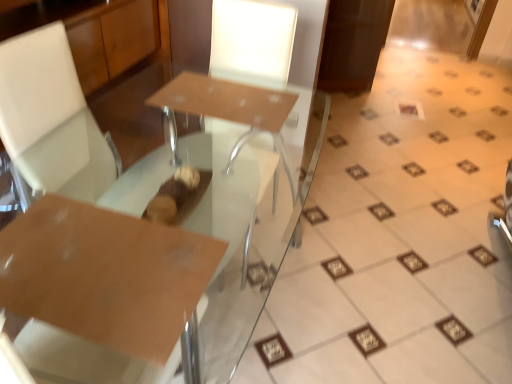
Question: Is glossy brown table at center positioned in front of white glossy frame at upper right?

Choices:
 (A) no
 (B) yes

Answer: (B)

Question: Considering the relative sizes of glossy brown table at center and white glossy frame at upper right in the image provided, is glossy brown table at center wider than white glossy frame at upper right?

Choices:
 (A) yes
 (B) no

Answer: (A)

Question: Is glossy brown table at center far from white glossy frame at upper right?

Choices:
 (A) yes
 (B) no

Answer: (A)

Question: Would you say glossy brown table at center contains white glossy frame at upper right?

Choices:
 (A) no
 (B) yes

Answer: (A)

Question: Does glossy brown table at center have a lesser height compared to white glossy frame at upper right?

Choices:
 (A) yes
 (B) no

Answer: (B)

Question: Can you confirm if glossy brown table at center is positioned to the right of white glossy frame at upper right?

Choices:
 (A) no
 (B) yes

Answer: (A)

Question: Is matte brown table at center not near white glossy frame at upper right?

Choices:
 (A) yes
 (B) no

Answer: (A)

Question: Can white glossy frame at upper right be found inside matte brown table at center?

Choices:
 (A) no
 (B) yes

Answer: (A)

Question: Is matte brown table at center positioned before white glossy frame at upper right?

Choices:
 (A) no
 (B) yes

Answer: (B)

Question: Is matte brown table at center oriented away from white glossy frame at upper right?

Choices:
 (A) no
 (B) yes

Answer: (A)

Question: From a real-world perspective, is matte brown table at center beneath white glossy frame at upper right?

Choices:
 (A) yes
 (B) no

Answer: (B)

Question: Can you confirm if matte brown table at center is wider than white glossy frame at upper right?

Choices:
 (A) no
 (B) yes

Answer: (B)

Question: Is matte brown table at center outside of glossy brown table at center?

Choices:
 (A) no
 (B) yes

Answer: (B)